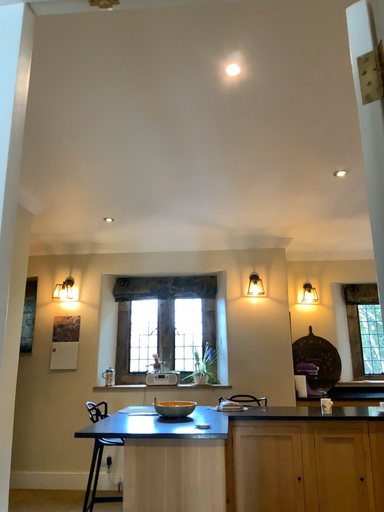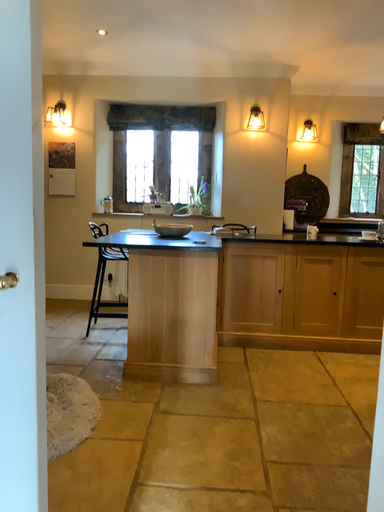
Question: Which way did the camera rotate in the video?

Choices:
 (A) rotated downward
 (B) rotated upward

Answer: (A)